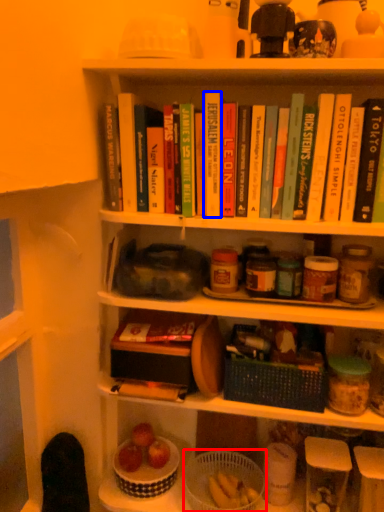
Question: Which point is closer to the camera, basket (highlighted by a red box) or paperback book (highlighted by a blue box)?

Choices:
 (A) basket
 (B) paperback book

Answer: (B)